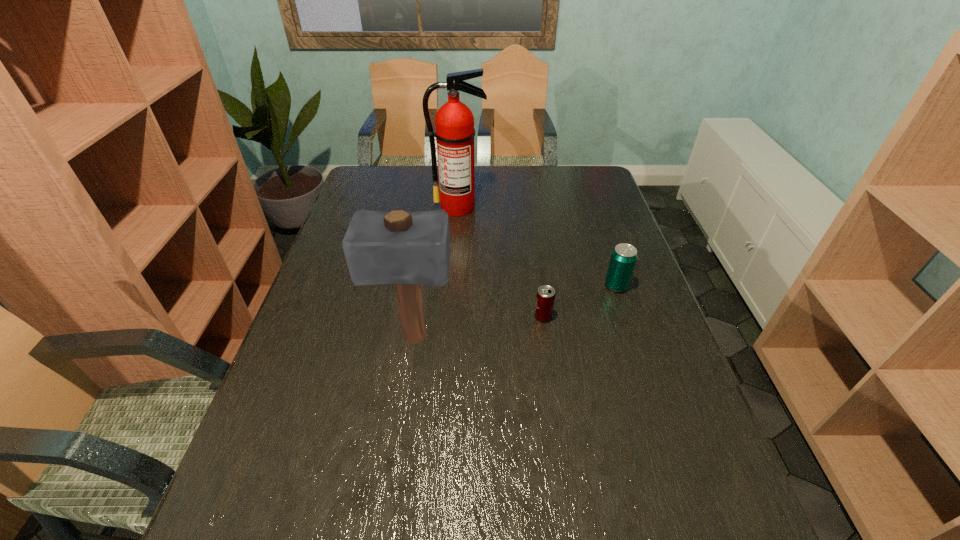
In order to click on vacant space that satisfies the following two spatial constraints: 1. on the side of the fire extinguisher near the handle; 2. on the right side of the right beer can in this screenshot , I will do `click(453, 286)`.